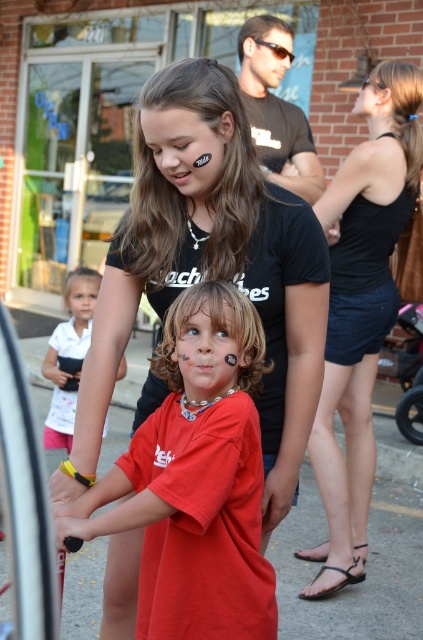
Does black denim shorts at lower right have a smaller size compared to white matte shirt at lower left?

Actually, black denim shorts at lower right might be larger than white matte shirt at lower left.

Is point (334, 184) closer to camera compared to point (65, 342)?

Yes, point (334, 184) is closer to viewer.

Identify the location of black denim shorts at lower right. (360, 308).

Does matte black shirt at center come behind white matte shirt at lower left?

That is False.

Can you confirm if matte black shirt at center is positioned above white matte shirt at lower left?

Indeed, matte black shirt at center is positioned over white matte shirt at lower left.

Between point (304, 269) and point (71, 376), which one is positioned behind?

The point (71, 376) is behind.

Where is `matte black shirt at center`? This screenshot has width=423, height=640. matte black shirt at center is located at coordinates (209, 266).

Can you confirm if matte red shirt at center is shorter than white matte shirt at lower left?

Indeed, matte red shirt at center has a lesser height compared to white matte shirt at lower left.

Is matte red shirt at center thinner than white matte shirt at lower left?

No.

Who is more forward, (159, 604) or (80, 339)?

Point (159, 604) is more forward.

Find the location of `matte red shirt at center`. matte red shirt at center is located at coordinates (195, 480).